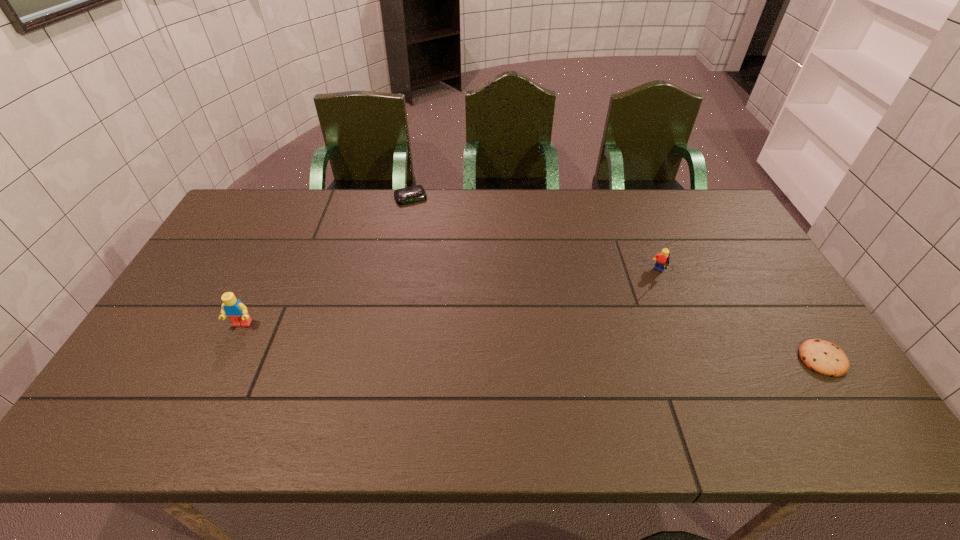
This screenshot has width=960, height=540. I want to click on vacant space on the desktop that is between the leftmost object and the nearest object and is positioned on the display of the farthest object, so click(x=475, y=339).

At what (x,y) coordinates should I click in order to perform the action: click on vacant spot on the desktop that is between the leftmost object and the nearest object and is positioned on the front-facing side of the third object from left to right. Please return your answer as a coordinate pair (x, y). The width and height of the screenshot is (960, 540). Looking at the image, I should click on (609, 347).